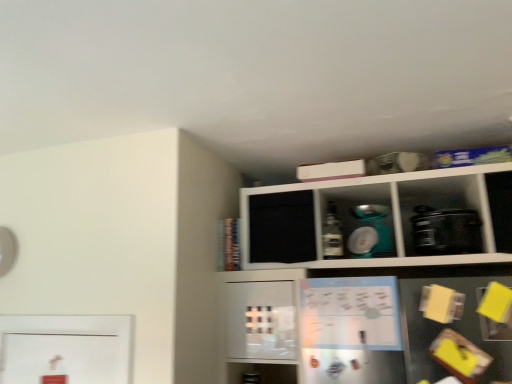
Question: From the image's perspective, is matte white bowl at upper center, acting as the 2th appliance starting from the right, on top of black plastic toaster at right, placed as the 1th appliance when sorted from right to left?

Choices:
 (A) no
 (B) yes

Answer: (B)

Question: Could you tell me if matte white bowl at upper center, which is the 1th appliance in left-to-right order, is facing black plastic toaster at right, placed as the 1th appliance when sorted from right to left?

Choices:
 (A) no
 (B) yes

Answer: (A)

Question: Is the surface of matte white bowl at upper center, which is the 1th appliance in left-to-right order, in direct contact with black plastic toaster at right, which is the 2th appliance from left to right?

Choices:
 (A) no
 (B) yes

Answer: (A)

Question: Can you confirm if matte white bowl at upper center, acting as the 2th appliance starting from the right, is taller than black plastic toaster at right, placed as the 1th appliance when sorted from right to left?

Choices:
 (A) no
 (B) yes

Answer: (B)

Question: Are matte white bowl at upper center, acting as the 2th appliance starting from the right, and black plastic toaster at right, placed as the 1th appliance when sorted from right to left, far apart?

Choices:
 (A) no
 (B) yes

Answer: (A)

Question: Is black plastic toaster at right, which is the 2th appliance from left to right, at the back of matte white bowl at upper center, acting as the 2th appliance starting from the right?

Choices:
 (A) no
 (B) yes

Answer: (A)

Question: Can you see matte white bowl at upper center, which is the 1th appliance in left-to-right order, touching matte plastic bottle at center?

Choices:
 (A) yes
 (B) no

Answer: (B)

Question: Is matte white bowl at upper center, acting as the 2th appliance starting from the right, bigger than matte plastic bottle at center?

Choices:
 (A) yes
 (B) no

Answer: (A)

Question: Is matte white bowl at upper center, acting as the 2th appliance starting from the right, surrounding matte plastic bottle at center?

Choices:
 (A) no
 (B) yes

Answer: (A)

Question: Considering the relative positions of matte white bowl at upper center, which is the 1th appliance in left-to-right order, and matte plastic bottle at center in the image provided, is matte white bowl at upper center, which is the 1th appliance in left-to-right order, behind matte plastic bottle at center?

Choices:
 (A) yes
 (B) no

Answer: (A)

Question: From a real-world perspective, is matte white bowl at upper center, acting as the 2th appliance starting from the right, located beneath matte plastic bottle at center?

Choices:
 (A) no
 (B) yes

Answer: (A)

Question: Does matte white bowl at upper center, which is the 1th appliance in left-to-right order, lie in front of matte plastic bottle at center?

Choices:
 (A) no
 (B) yes

Answer: (A)

Question: Can you confirm if matte plastic bottle at center is shorter than black plastic toaster at right, placed as the 1th appliance when sorted from right to left?

Choices:
 (A) yes
 (B) no

Answer: (B)